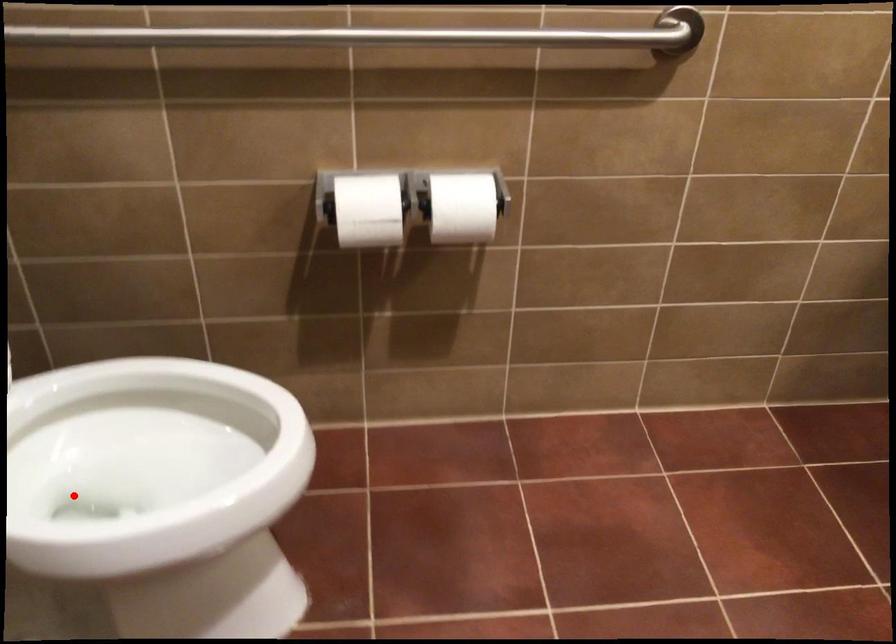
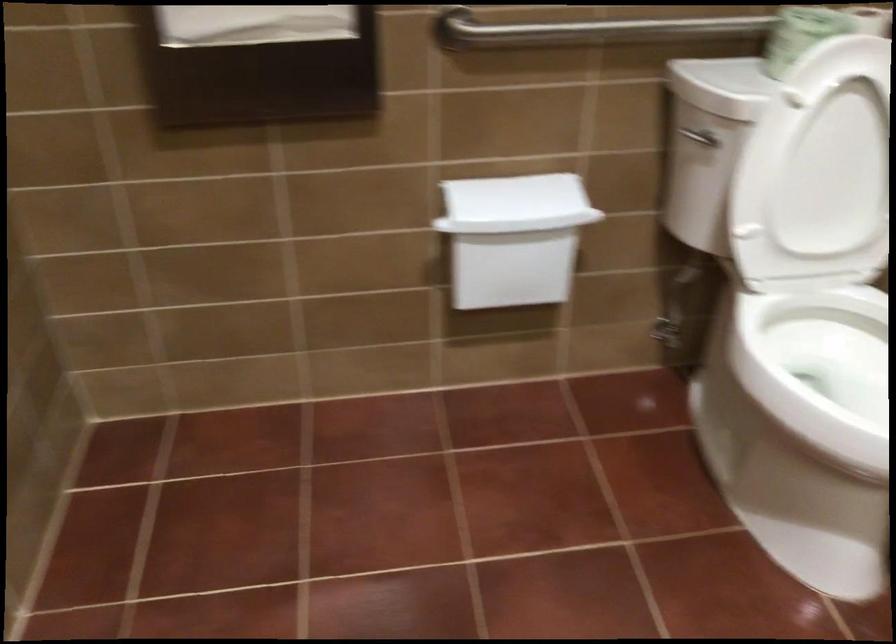
Locate, in the second image, the point that corresponds to the highlighted location in the first image.

(819, 368)